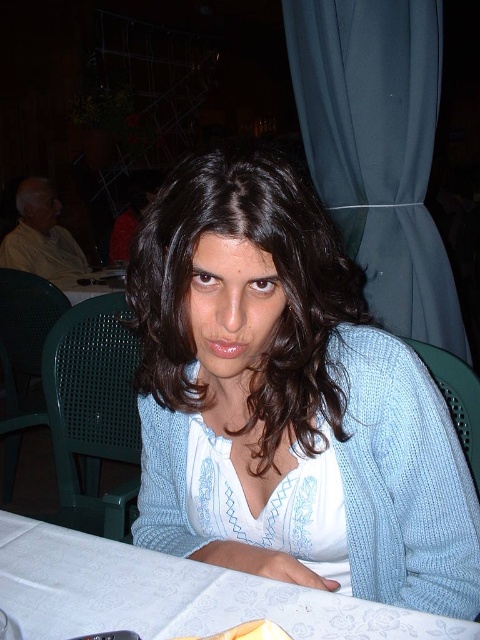
Is light blue knit sweater at center behind white fabric table at lower center?

No.

Is light blue knit sweater at center smaller than white fabric table at lower center?

Actually, light blue knit sweater at center might be larger than white fabric table at lower center.

I want to click on light blue knit sweater at center, so [x=288, y=403].